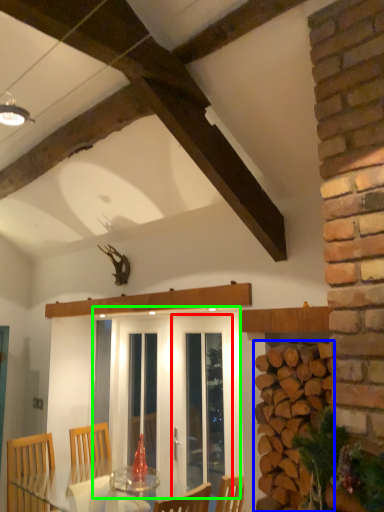
Question: Estimate the real-world distances between objects in this image. Which object is farther from screen door (highlighted by a red box), brickwork (highlighted by a blue box) or screen door (highlighted by a green box)?

Choices:
 (A) brickwork
 (B) screen door

Answer: (A)